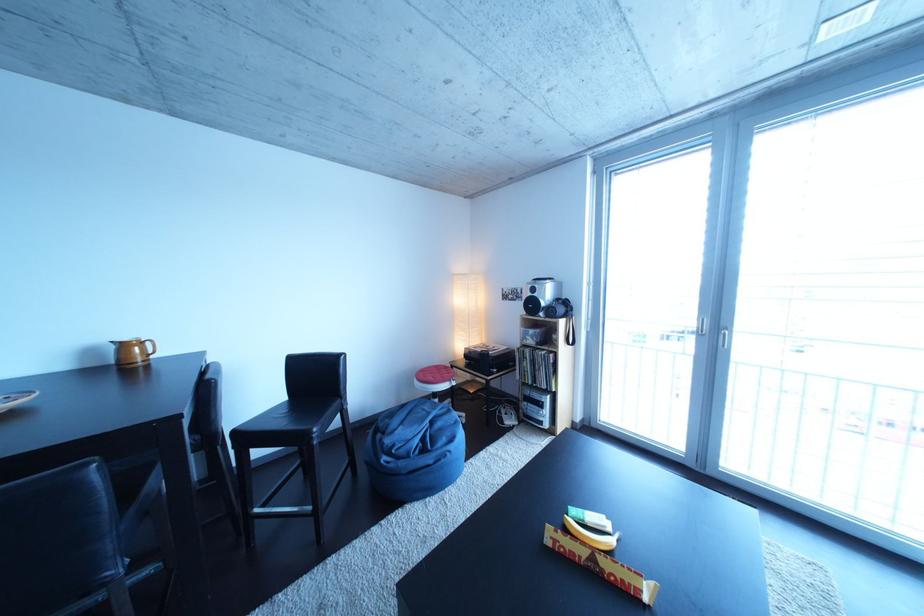
Where is `yellow banana`? The width and height of the screenshot is (924, 616). yellow banana is located at coordinates (590, 536).